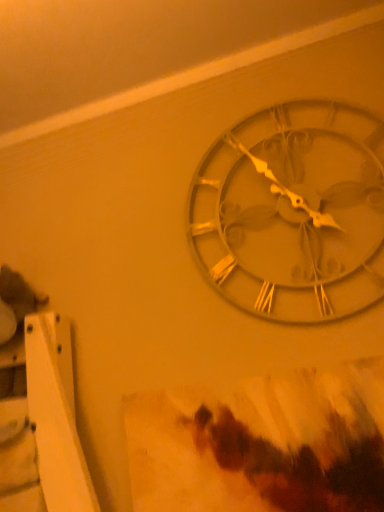
The width and height of the screenshot is (384, 512). Describe the element at coordinates (293, 213) in the screenshot. I see `metallic gold clock at upper right` at that location.

Where is `metallic gold clock at upper right`? metallic gold clock at upper right is located at coordinates (293, 213).

Image resolution: width=384 pixels, height=512 pixels. What are the coordinates of `metallic gold clock at upper right` in the screenshot? It's located at (293, 213).